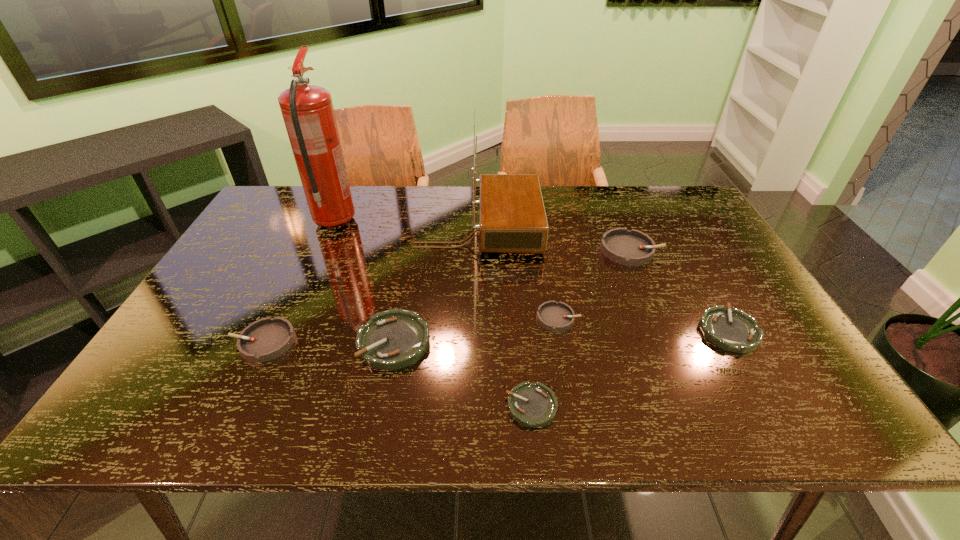
This screenshot has width=960, height=540. I want to click on vacant space at the left edge of the desktop, so click(285, 248).

Where is `vacant space at the far left corner`? This screenshot has width=960, height=540. vacant space at the far left corner is located at coordinates (292, 203).

The width and height of the screenshot is (960, 540). I want to click on empty location between the smallest gray ashtray and the leftmost green ashtray, so click(476, 330).

The height and width of the screenshot is (540, 960). Find the location of `free space between the sixth shortest object and the shortest ashtray`. free space between the sixth shortest object and the shortest ashtray is located at coordinates (581, 328).

Identify the location of free space between the fire extinguisher and the rightmost green ashtray. (532, 276).

Image resolution: width=960 pixels, height=540 pixels. Identify the location of vacant point located between the radio_receiver and the second smallest gray ashtray. (371, 285).

Locate an element on the screen. free space between the fire extinguisher and the second smallest green ashtray is located at coordinates (532, 276).

Where is `free space between the farthest ashtray and the smallest gray ashtray`? free space between the farthest ashtray and the smallest gray ashtray is located at coordinates (594, 284).

The height and width of the screenshot is (540, 960). In order to click on vacant area that lies between the nearest object and the smallest gray ashtray in this screenshot , I will do `click(544, 362)`.

Identify the location of free space between the biggest green ashtray and the tallest ashtray. (513, 296).